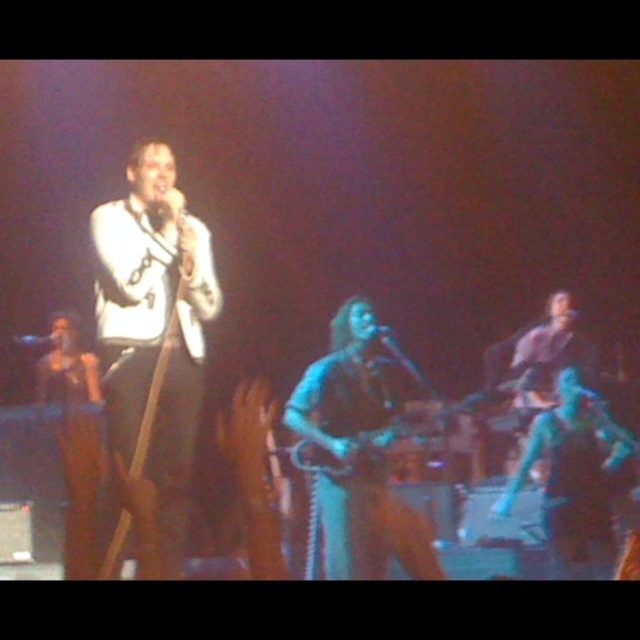
Is metallic silver microphone at upper center closer to camera compared to metallic blue microphone at center?

That is False.

Is point (22, 337) positioned in front of point (369, 332)?

That is False.

Which is in front, point (17, 340) or point (372, 330)?

Point (372, 330) is in front.

Locate an element on the screen. metallic silver microphone at upper center is located at coordinates (36, 340).

This screenshot has height=640, width=640. What do you see at coordinates (573, 474) in the screenshot?
I see `blue fabric pants at right` at bounding box center [573, 474].

Is blue fabric pants at right below metallic silver microphone at upper center?

Yes, blue fabric pants at right is below metallic silver microphone at upper center.

Find the location of a particular element. This screenshot has height=640, width=640. blue fabric pants at right is located at coordinates (573, 474).

The height and width of the screenshot is (640, 640). Identify the location of blue fabric pants at right. (573, 474).

In the scene shown: Can you confirm if blue leather jacket at center is positioned below metallic silver microphone at upper center?

Yes, blue leather jacket at center is below metallic silver microphone at upper center.

Can you confirm if blue leather jacket at center is wider than metallic silver microphone at upper center?

Yes.

Locate an element on the screen. blue leather jacket at center is located at coordinates (356, 456).

The width and height of the screenshot is (640, 640). I want to click on blue leather jacket at center, so click(356, 456).